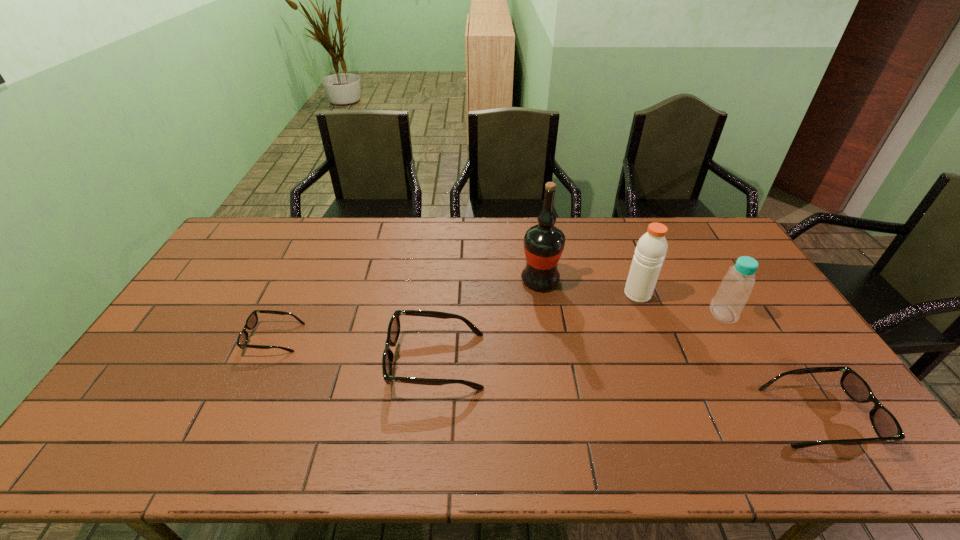
Where is `vacant area located on the lenses of the shortest object`? The height and width of the screenshot is (540, 960). vacant area located on the lenses of the shortest object is located at coordinates (204, 338).

Where is `vacant space located 0.190m on the lenses of the shortest object`? The image size is (960, 540). vacant space located 0.190m on the lenses of the shortest object is located at coordinates (183, 338).

This screenshot has width=960, height=540. What are the coordinates of `vacant area situated 0.210m on the lenses of the shortest object` in the screenshot? It's located at (177, 338).

This screenshot has width=960, height=540. I want to click on vacant space located 0.350m on the lenses of the second object from left to right, so click(x=263, y=361).

Identify the location of vacant space located on the lenses of the second object from left to right. The width and height of the screenshot is (960, 540). (353, 361).

At what (x,y) coordinates should I click in order to perform the action: click on vacant space located on the lenses of the second object from left to right. Please return your answer as a coordinate pair (x, y). Looking at the image, I should click on (299, 361).

Find the location of a particular element. The height and width of the screenshot is (540, 960). vacant region located 0.370m on the front of the wine bottle is located at coordinates (557, 390).

The width and height of the screenshot is (960, 540). What are the coordinates of `vacant space located 0.270m on the left of the shaker` in the screenshot? It's located at (540, 294).

Where is `vacant point located 0.180m on the left of the fourth shortest object`? vacant point located 0.180m on the left of the fourth shortest object is located at coordinates tap(652, 314).

Find the location of a particular element. spectacles that is at the right edge is located at coordinates (884, 423).